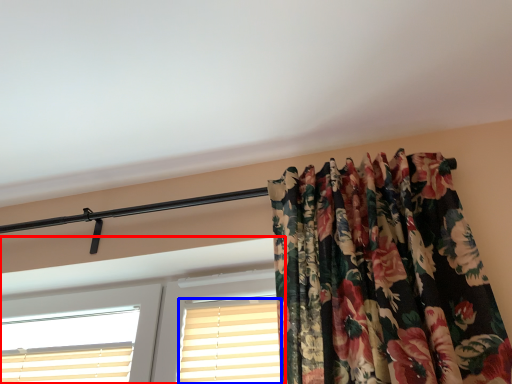
Question: Among these objects, which one is nearest to the camera, window (highlighted by a red box) or shutter (highlighted by a blue box)?

Choices:
 (A) window
 (B) shutter

Answer: (A)